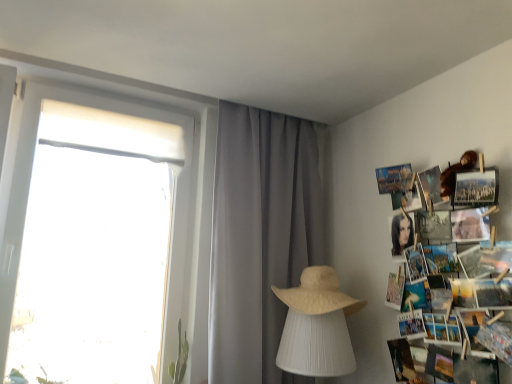
Question: Is beige straw hat at center outside of gray sheer curtain at center?

Choices:
 (A) yes
 (B) no

Answer: (A)

Question: Is the position of beige straw hat at center more distant than that of gray sheer curtain at center?

Choices:
 (A) yes
 (B) no

Answer: (B)

Question: From a real-world perspective, is beige straw hat at center positioned under gray sheer curtain at center based on gravity?

Choices:
 (A) yes
 (B) no

Answer: (A)

Question: Would you consider beige straw hat at center to be distant from gray sheer curtain at center?

Choices:
 (A) yes
 (B) no

Answer: (B)

Question: From a real-world perspective, is beige straw hat at center positioned over gray sheer curtain at center based on gravity?

Choices:
 (A) yes
 (B) no

Answer: (B)

Question: From the image's perspective, is beige straw hat at center on top of gray sheer curtain at center?

Choices:
 (A) yes
 (B) no

Answer: (B)

Question: Is gray sheer curtain at center taller than printed paper collage at right?

Choices:
 (A) yes
 (B) no

Answer: (A)

Question: Can you confirm if gray sheer curtain at center is smaller than printed paper collage at right?

Choices:
 (A) no
 (B) yes

Answer: (A)

Question: From a real-world perspective, is gray sheer curtain at center over printed paper collage at right?

Choices:
 (A) yes
 (B) no

Answer: (A)

Question: Considering the relative sizes of gray sheer curtain at center and printed paper collage at right in the image provided, is gray sheer curtain at center bigger than printed paper collage at right?

Choices:
 (A) no
 (B) yes

Answer: (B)

Question: Is printed paper collage at right completely or partially inside gray sheer curtain at center?

Choices:
 (A) yes
 (B) no

Answer: (B)

Question: Is gray sheer curtain at center completely or partially outside of printed paper collage at right?

Choices:
 (A) yes
 (B) no

Answer: (A)

Question: Is printed paper collage at right not close to beige straw hat at center?

Choices:
 (A) no
 (B) yes

Answer: (A)